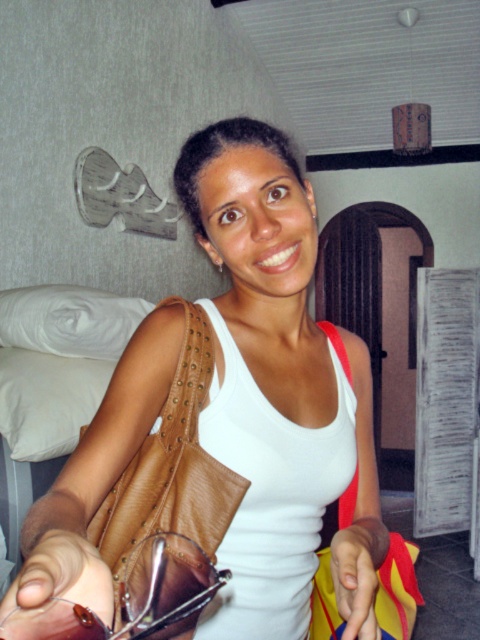
Is leather at left smaller than smooth yellow fabric at lower center?

No, leather at left is not smaller than smooth yellow fabric at lower center.

Who is more forward, (186, 508) or (351, 595)?

Point (351, 595)

Locate an element on the screen. The image size is (480, 640). leather at left is located at coordinates (171, 467).

Is matte brown purse at center closer to the viewer compared to leather glasses at lower left?

Yes, matte brown purse at center is in front of leather glasses at lower left.

Between matte brown purse at center and leather glasses at lower left, which one is positioned higher?

matte brown purse at center

Who is more forward, [228,616] or [70,614]?

Positioned in front is point [70,614].

At what (x,y) coordinates should I click in order to perform the action: click on matte brown purse at center. Please return your answer as a coordinate pair (x, y). Looking at the image, I should click on (222, 406).

Is matte brown purse at center smaller than smooth yellow fabric at lower center?

No, matte brown purse at center is not smaller than smooth yellow fabric at lower center.

Does point (194, 216) come in front of point (370, 522)?

Yes, it is.

Find the location of a particular element. The image size is (480, 640). matte brown purse at center is located at coordinates pyautogui.click(x=222, y=406).

You are a GUI agent. You are given a task and a screenshot of the screen. Output one action in this format:
    pyautogui.click(x=<x>, y=<y>)
    Task: Click on the matte brown purse at center
    This screenshot has width=480, height=640.
    Given the screenshot: What is the action you would take?
    pyautogui.click(x=222, y=406)